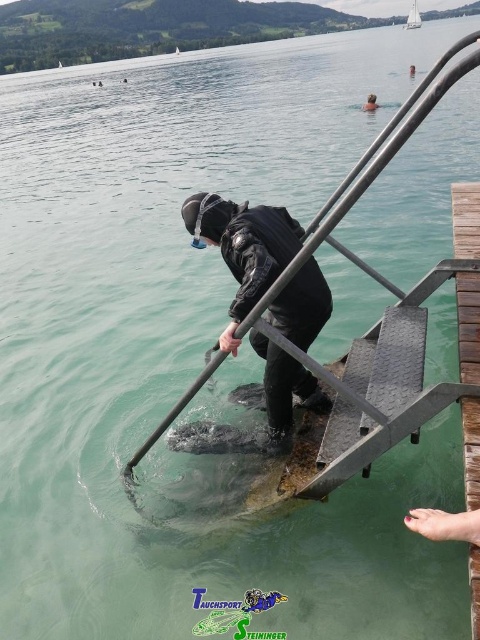
Question: Among these objects, which one is nearest to the camera?

Choices:
 (A) black matte wetsuit at lower center
 (B) white plastic boat at upper center

Answer: (A)

Question: Is white plastic boat at upper center positioned before black matte wetsuit at lower center?

Choices:
 (A) yes
 (B) no

Answer: (B)

Question: Which object is closer to the camera taking this photo?

Choices:
 (A) black matte diving suit at center
 (B) black matte wetsuit at lower center
 (C) smooth skin foot at lower right
 (D) white plastic boat at upper center

Answer: (C)

Question: Is black matte diving suit at center to the left of black matte wetsuit at lower center from the viewer's perspective?

Choices:
 (A) yes
 (B) no

Answer: (A)

Question: Is white plastic boat at upper center wider than black matte wetsuit at lower center?

Choices:
 (A) yes
 (B) no

Answer: (A)

Question: Which of these objects is positioned closest to the black matte diving suit at center?

Choices:
 (A) white plastic boat at upper center
 (B) smooth skin foot at lower right
 (C) black matte wetsuit at lower center

Answer: (B)